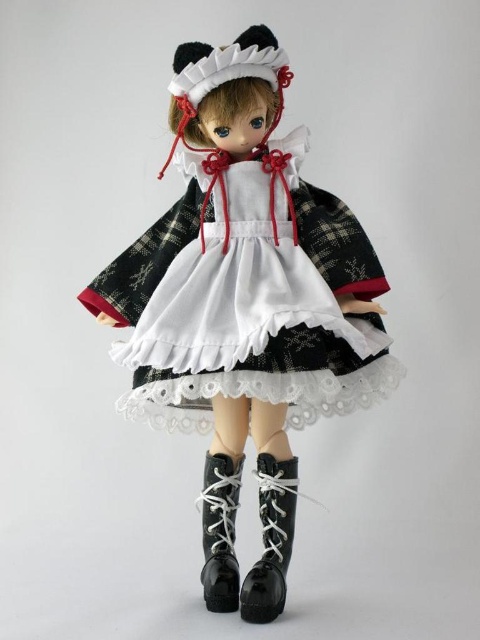
In the scene shown: You are a toy collector who wants to place a new doll on your shelf. The shelf has a mark at point (x=272, y=540). Where should you place the doll so that its black rubber boot at lower center aligns with the mark?

Place the doll so that its black rubber boot at lower center is positioned at point (x=272, y=540).

You are an artist trying to paint the doll in the image. You need to decide the order of painting layers. Which object should you paint first, the matte black dress at center or the black rubber boot at lower center?

The matte black dress at center is in front of the black rubber boot at lower center, so you should paint the matte black dress at center first to ensure proper layering.

You are a fashion designer examining the doll and notice the matte black dress at center and the black rubber boot at lower center. Which item is covering part of the other?

The matte black dress at center is positioned over the black rubber boot at lower center, so the dress is covering part of the boot.